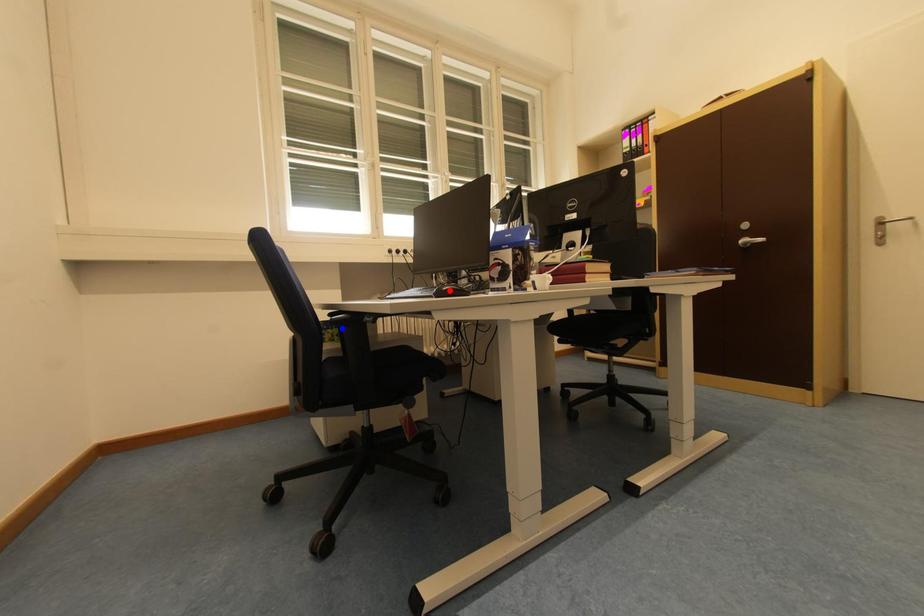
Question: In the image, two points are highlighted. Which point is nearer to the camera? Reply with the corresponding letter.

Choices:
 (A) blue point
 (B) red point

Answer: (B)